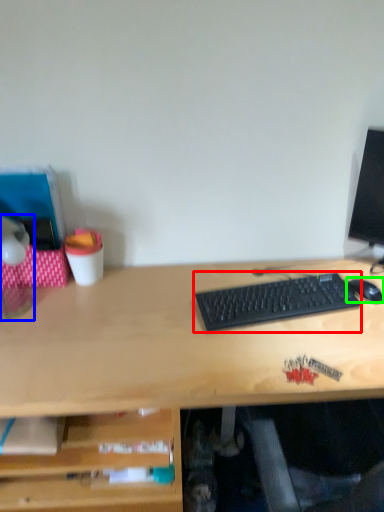
Question: Which object is the closest to the computer keyboard (highlighted by a red box)? Choose among these: table lamp (highlighted by a blue box) or mouse (highlighted by a green box).

Choices:
 (A) table lamp
 (B) mouse

Answer: (B)